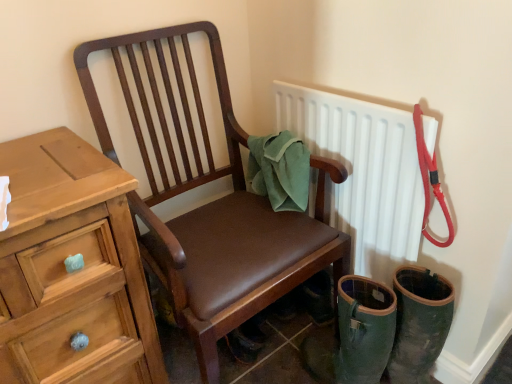
Question: Relative to green fabric towel at chair back, is wooden chest of drawers at left in front or behind?

Choices:
 (A) behind
 (B) front

Answer: (B)

Question: Based on their positions, is wooden chest of drawers at left located to the left or right of green fabric towel at chair back?

Choices:
 (A) right
 (B) left

Answer: (B)

Question: Estimate the real-world distances between objects in this image. Which object is closer to the brown leather chair at center?

Choices:
 (A) white matte radiator at upper right
 (B) green fabric towel at chair back
 (C) wooden chest of drawers at left

Answer: (B)

Question: Which of these objects is positioned farthest from the wooden chest of drawers at left?

Choices:
 (A) white matte radiator at upper right
 (B) brown leather chair at center
 (C) green fabric towel at chair back

Answer: (A)